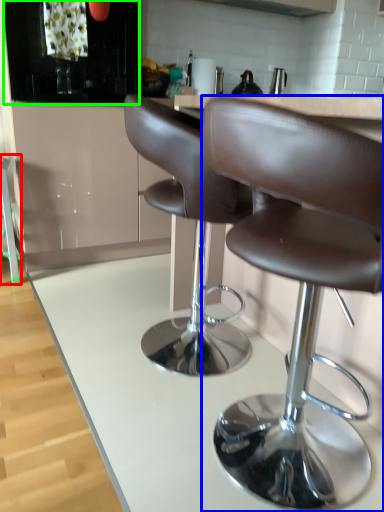
Question: Which object is the closest to the bar stool (highlighted by a red box)? Choose among these: chair (highlighted by a blue box) or cabinetry (highlighted by a green box).

Choices:
 (A) chair
 (B) cabinetry

Answer: (B)